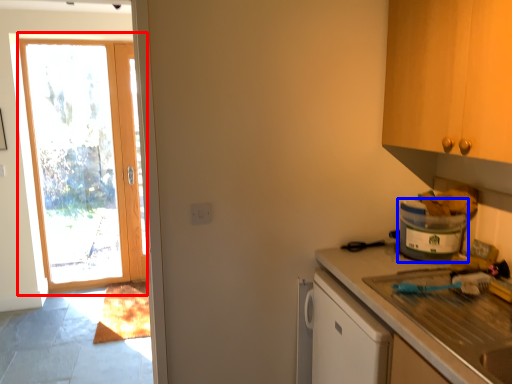
Question: Which point is closer to the camera, door (highlighted by a red box) or appliance (highlighted by a blue box)?

Choices:
 (A) door
 (B) appliance

Answer: (B)